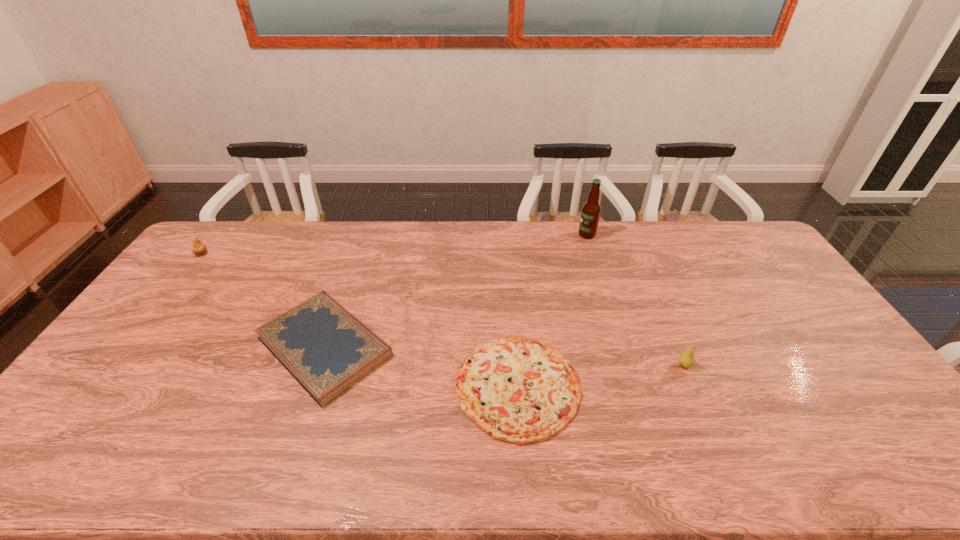
Identify the location of vacant space located on the label of the farthest object. The height and width of the screenshot is (540, 960). click(x=487, y=234).

This screenshot has width=960, height=540. I want to click on free location located on the label of the farthest object, so click(549, 234).

I want to click on vacant space situated 0.100m on the label of the farthest object, so click(552, 234).

Identify the location of vacant point located 0.160m on the back of the left pear. (x=224, y=225).

The image size is (960, 540). I want to click on blank space located 0.330m on the right of the nearer pear, so click(810, 365).

You are a GUI agent. You are given a task and a screenshot of the screen. Output one action in this format:
    pyautogui.click(x=<x>, y=<y>)
    Task: Click on the vacant region located 0.110m on the back of the second object from left to right
    The height and width of the screenshot is (540, 960).
    Given the screenshot: What is the action you would take?
    pyautogui.click(x=348, y=276)

At what (x,y) coordinates should I click in order to perform the action: click on vacant space situated 0.400m on the back of the third object from left to right. Please return your answer as a coordinate pair (x, y). The height and width of the screenshot is (540, 960). Looking at the image, I should click on (508, 254).

The height and width of the screenshot is (540, 960). In order to click on beer bottle that is at the far edge in this screenshot , I will do click(591, 210).

You are a GUI agent. You are given a task and a screenshot of the screen. Output one action in this format:
    pyautogui.click(x=<x>, y=<y>)
    Task: Click on the pear at the far edge
    
    Given the screenshot: What is the action you would take?
    pyautogui.click(x=198, y=248)

Identify the location of object that is at the near edge. This screenshot has width=960, height=540. (517, 389).